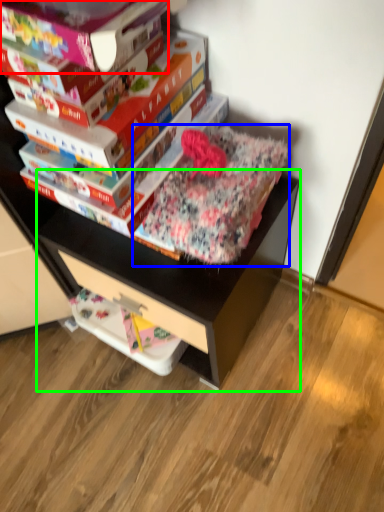
Question: Which object is positioned farthest from paperback book (highlighted by a red box)? Select from bedding (highlighted by a blue box) and computer desk (highlighted by a green box).

Choices:
 (A) bedding
 (B) computer desk

Answer: (B)